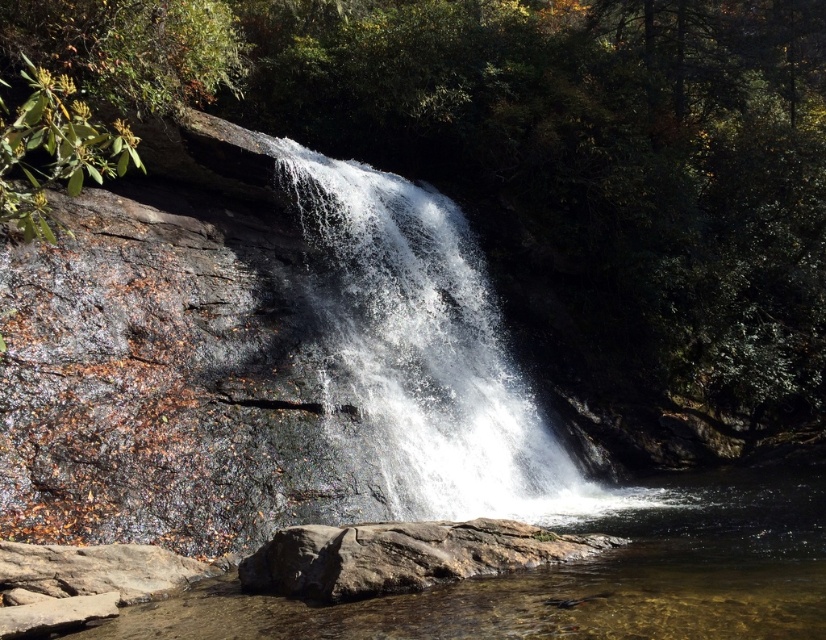
You are standing at the edge of the pool below the waterfall. You see the white frothy water at center and the brown rough rock at lower center. Which object is closer to you?

The white frothy water at center is closer to you because the brown rough rock at lower center is behind it.

You are a photographer planning to capture the waterfall scene. You want to ensure that the clear water at center and the brown rough rock at lower center are both visible in your shot. Based on their sizes, which object should you focus on to include both in the frame?

The clear water at center is larger in size than the brown rough rock at lower center. To include both in the frame, focus on the larger clear water at center, as it occupies more space and will help balance the composition with the smaller brown rough rock at lower center.

You are standing near the waterfall and want to place a small decorative stone on the brown rough rock at lower center. However, there is white frothy water at center above it. Do you think the stone will stay on the rock without getting washed away by the water?

The white frothy water at center is positioned over the brown rough rock at lower center, so the water is flowing directly onto the rock. This means the stone placed there might get washed away by the cascading water.